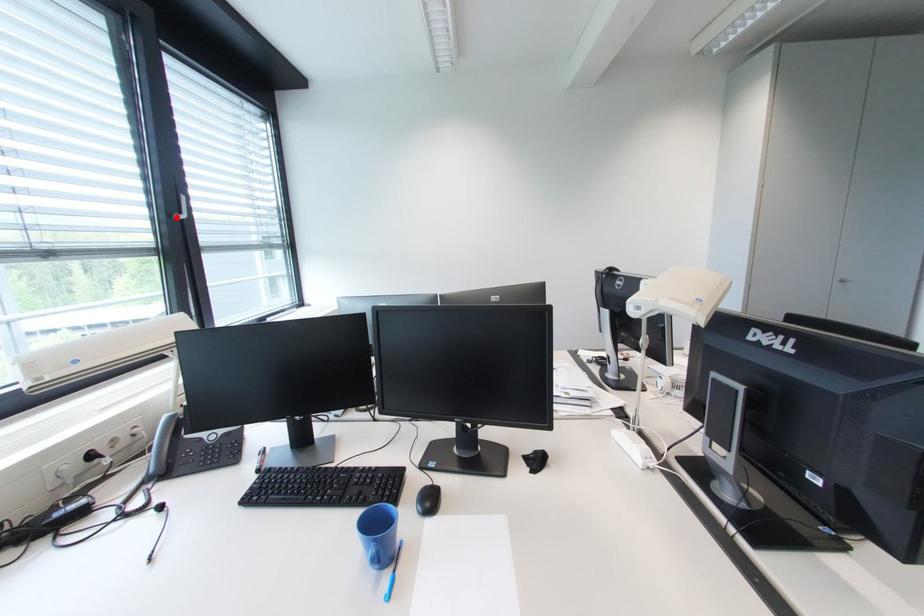
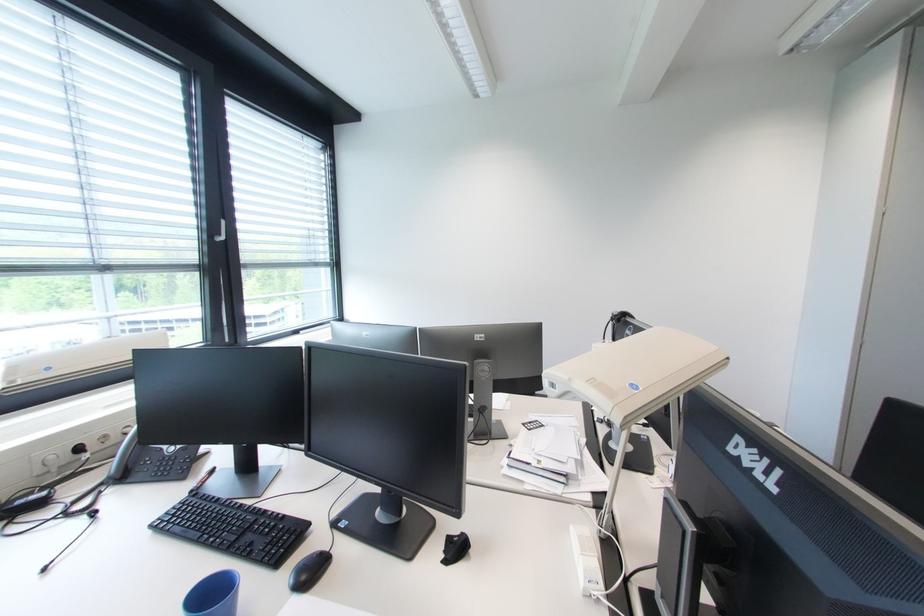
Find the pixel in the second image that matches the highlighted location in the first image.

(217, 238)